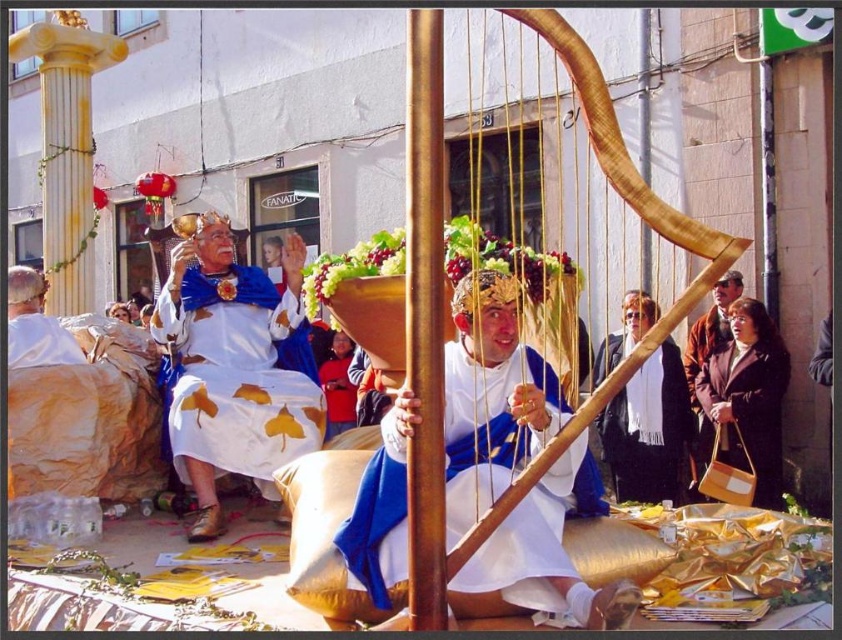
You are at the event and want to pick up the white scarf at center and the brown leather handbag at lower right. Which item should you reach for first if you want to grab the one nearest to you?

The white scarf at center is closer to the viewer than the brown leather handbag at lower right, so you should reach for the white scarf at center first.

You are a photographer standing near the camera. You want to capture a photo of the white scarf at center without moving the camera. Is the scarf within the camera lens range of 70 feet? Please answer concisely.

Yes, the white scarf at center and camera are 70.24 feet apart, which is within the 70 feet range.

Based on the scene description, where exactly is the white satin dress at upper left located in the image?

The white satin dress at upper left is located at point (238, 376).